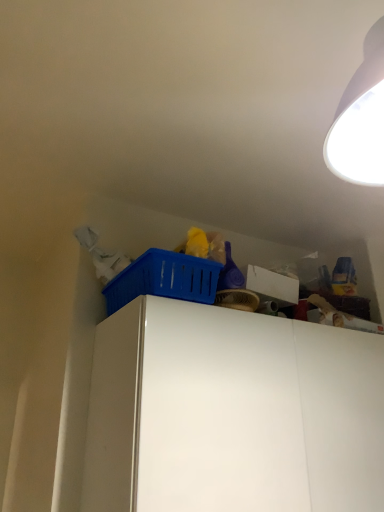
Question: Is blue plastic basket at upper center directly adjacent to white matte cabinet at upper right?

Choices:
 (A) no
 (B) yes

Answer: (A)

Question: Is blue plastic basket at upper center shorter than white matte cabinet at upper right?

Choices:
 (A) no
 (B) yes

Answer: (B)

Question: Can you confirm if blue plastic basket at upper center is taller than white matte cabinet at upper right?

Choices:
 (A) yes
 (B) no

Answer: (B)

Question: Does blue plastic basket at upper center have a larger size compared to white matte cabinet at upper right?

Choices:
 (A) yes
 (B) no

Answer: (B)

Question: Does blue plastic basket at upper center lie behind white matte cabinet at upper right?

Choices:
 (A) no
 (B) yes

Answer: (B)

Question: From the image's perspective, would you say blue plastic basket at upper center is shown under white matte cabinet at upper right?

Choices:
 (A) no
 (B) yes

Answer: (A)

Question: Would you say white matte cabinet at upper right is a long distance from blue plastic basket at upper center?

Choices:
 (A) yes
 (B) no

Answer: (B)

Question: From the image's perspective, is white matte cabinet at upper right above blue plastic basket at upper center?

Choices:
 (A) no
 (B) yes

Answer: (A)

Question: Considering the relative sizes of white matte cabinet at upper right and blue plastic basket at upper center in the image provided, is white matte cabinet at upper right taller than blue plastic basket at upper center?

Choices:
 (A) yes
 (B) no

Answer: (A)

Question: Is the depth of white matte cabinet at upper right greater than that of blue plastic basket at upper center?

Choices:
 (A) yes
 (B) no

Answer: (B)

Question: Is white matte cabinet at upper right smaller than blue plastic basket at upper center?

Choices:
 (A) no
 (B) yes

Answer: (A)

Question: Does white matte cabinet at upper right appear on the right side of blue plastic basket at upper center?

Choices:
 (A) no
 (B) yes

Answer: (B)

Question: Is point (134, 339) positioned closer to the camera than point (178, 267)?

Choices:
 (A) closer
 (B) farther

Answer: (A)